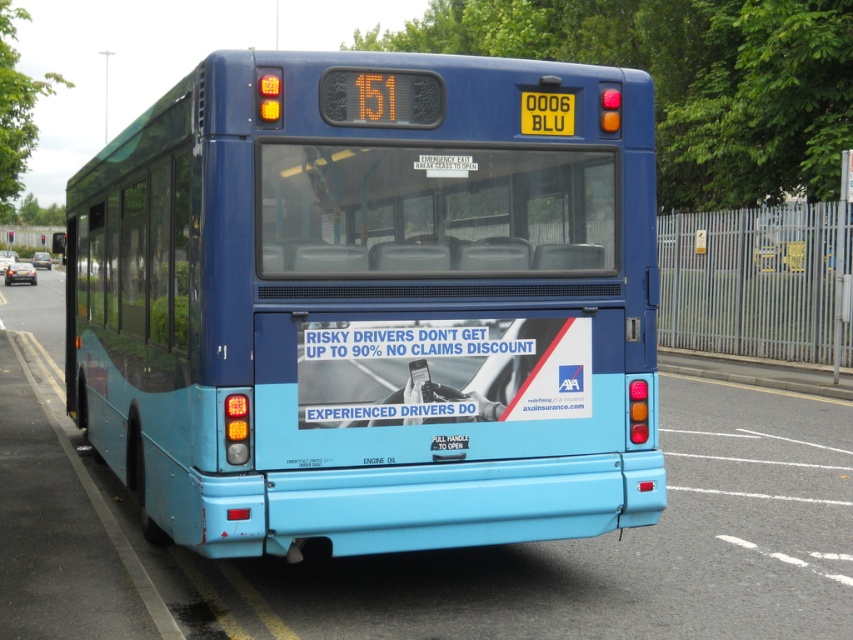
Does matte blue bus at center have a greater width compared to yellow plastic license plate at center?

Yes, matte blue bus at center is wider than yellow plastic license plate at center.

Can you confirm if matte blue bus at center is thinner than yellow plastic license plate at center?

Incorrect, matte blue bus at center's width is not less than yellow plastic license plate at center's.

What do you see at coordinates (370, 305) in the screenshot?
I see `matte blue bus at center` at bounding box center [370, 305].

Where is `matte blue bus at center`? matte blue bus at center is located at coordinates (370, 305).